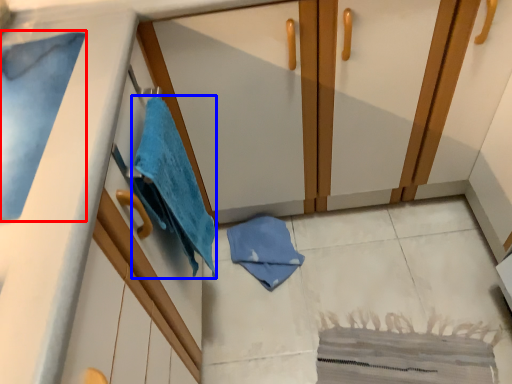
Question: Among these objects, which one is nearest to the camera, bath towel (highlighted by a red box) or beach towel (highlighted by a blue box)?

Choices:
 (A) bath towel
 (B) beach towel

Answer: (A)